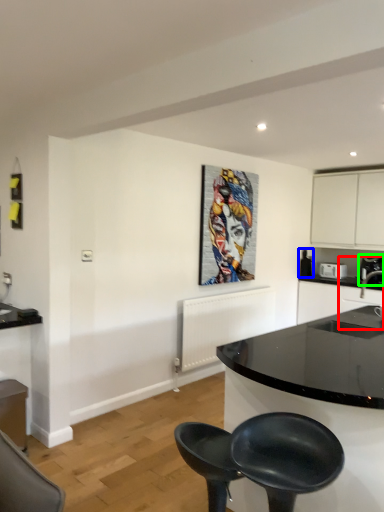
Question: Which object is the farthest from sink (highlighted by a red box)? Choose among these: appliance (highlighted by a blue box) or coffee machine (highlighted by a green box).

Choices:
 (A) appliance
 (B) coffee machine

Answer: (A)